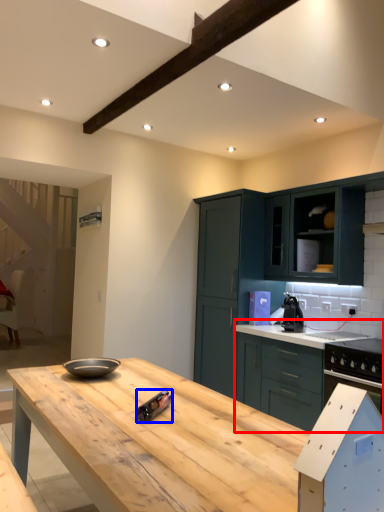
Question: Which point is closer to the camera, cabinetry (highlighted by a red box) or appliance (highlighted by a blue box)?

Choices:
 (A) cabinetry
 (B) appliance

Answer: (B)